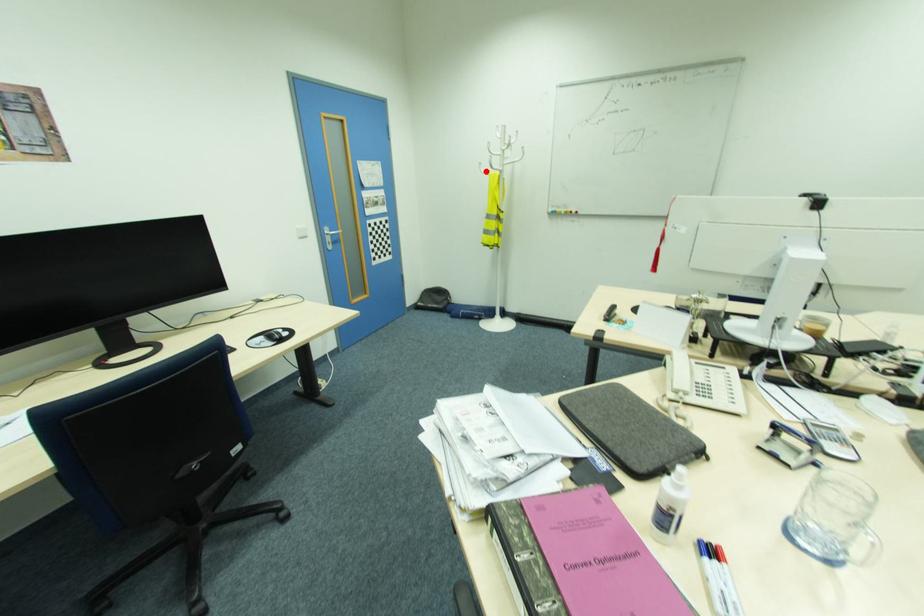
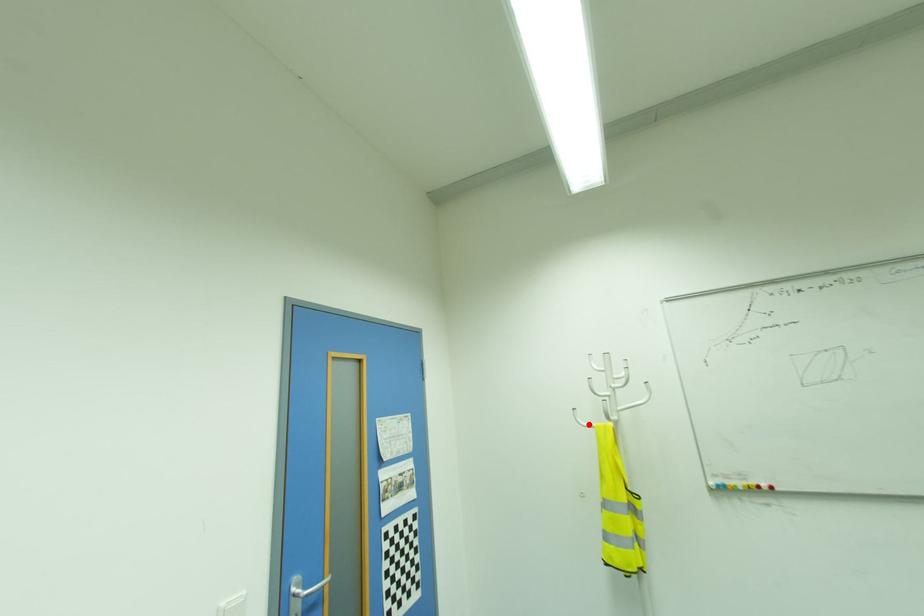
I am providing you with two images of the same scene from different viewpoints. A red point is marked on the first image and another point is marked on the second image. Is the marked point in image1 the same physical position as the marked point in image2?

Yes